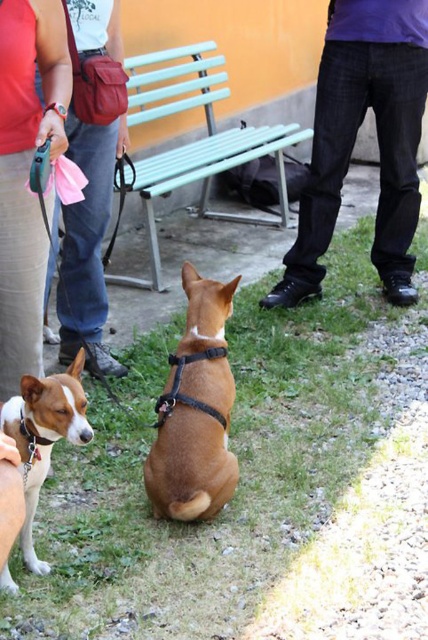
Can you confirm if black textured pants at right is positioned to the right of white leather collar at lower left?

Correct, you'll find black textured pants at right to the right of white leather collar at lower left.

Where is `black textured pants at right`? This screenshot has width=428, height=640. black textured pants at right is located at coordinates (354, 140).

Can you confirm if brown grass at center is shorter than brown matte harness at center?

Incorrect, brown grass at center's height does not fall short of brown matte harness at center's.

Is point (115, 588) more distant than point (228, 314)?

No.

Between point (368, 433) and point (178, 381), which one is positioned behind?

Point (368, 433)

In order to click on brown grass at center in this screenshot , I will do `click(240, 468)`.

Can you confirm if light blue plastic bench at center is shorter than brushed leather bag at left?

No.

Does light blue plastic bench at center appear under brushed leather bag at left?

Incorrect, light blue plastic bench at center is not positioned below brushed leather bag at left.

Does point (247, 157) lie in front of point (101, 360)?

That is False.

At what (x,y) coordinates should I click in order to perform the action: click on light blue plastic bench at center. Please return your answer as a coordinate pair (x, y). Looking at the image, I should click on (196, 141).